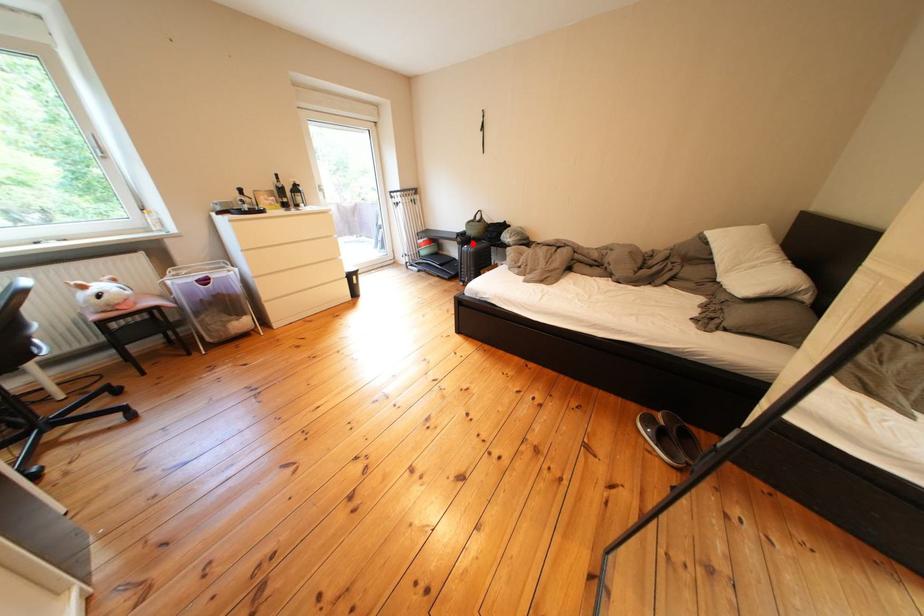
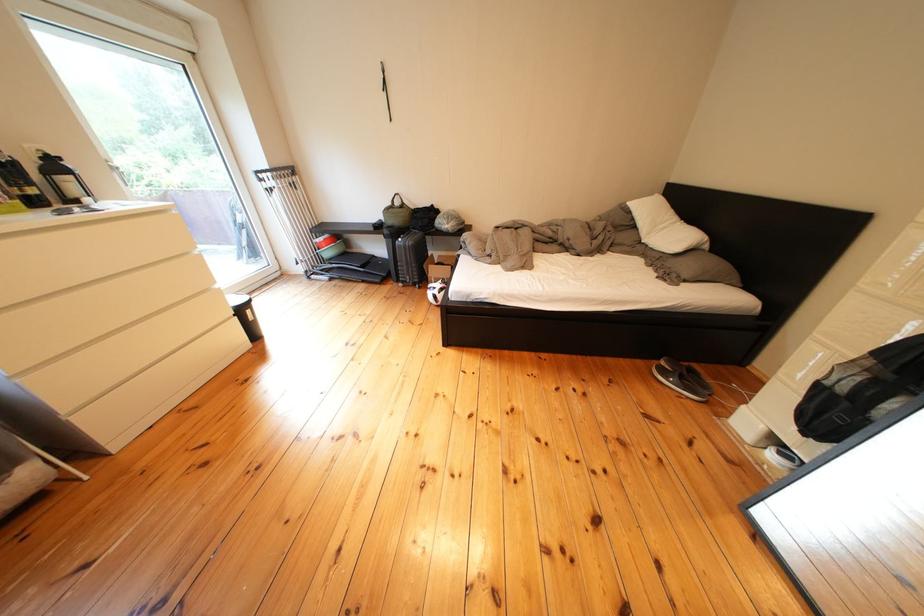
Find the pixel in the second image that matches the highlighted location in the first image.

(399, 236)